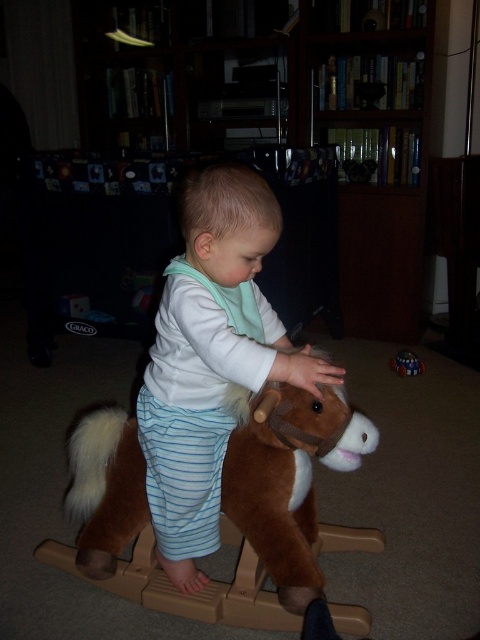
The scene shows a child on a rocking horse. There is a point marked at coordinates [211,358]. Which object from the list is located exactly at this point? The objects are the white soft toddler at center and the brown wooden rocking horse at lower left.

The point at coordinates [211,358] marks the white soft toddler at center.

You are a parent who wants to place a new toy on the wooden bookshelf at upper center for your child. The toy is 3 feet wide. Can the white soft toddler at center reach the toy if it is placed on the bookshelf?

The wooden bookshelf at upper center and white soft toddler at center are 6.21 feet apart from each other. Since the toy is 3 feet wide, the distance between them is greater than the toy width, so the white soft toddler at center cannot reach the toy placed on the wooden bookshelf at upper center.

You are a parent trying to place a new toy on the shelf. The wooden bookshelf at upper center and the shiny metallic ball at center are in view. Which object is wider?

The wooden bookshelf at upper center might be wider than shiny metallic ball at center.